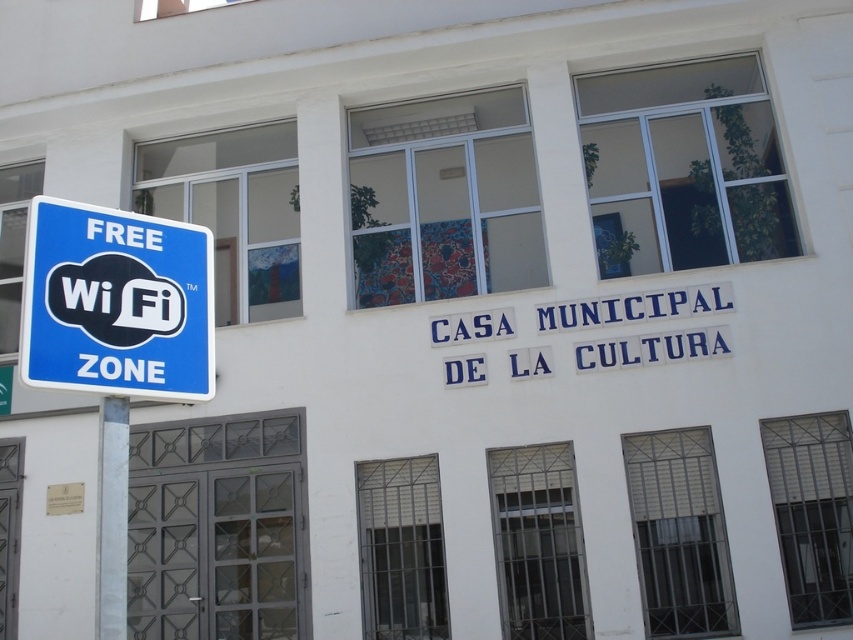
Who is more forward, (138, 356) or (97, 573)?

Point (97, 573) is more forward.

Between blue plastic sign at left and white marble pole at left, which one appears on the right side from the viewer's perspective?

From the viewer's perspective, white marble pole at left appears more on the right side.

Between point (62, 358) and point (103, 426), which one is positioned behind?

The point (103, 426) is behind.

Locate an element on the screen. The image size is (853, 640). blue plastic sign at left is located at coordinates (115, 304).